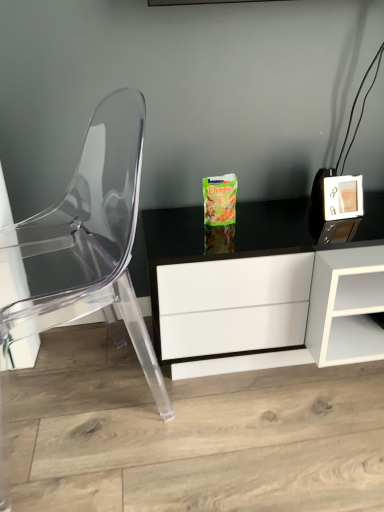
Identify the location of free spot below transparent plastic chair at left (from a real-world perspective). Image resolution: width=384 pixels, height=512 pixels. (66, 395).